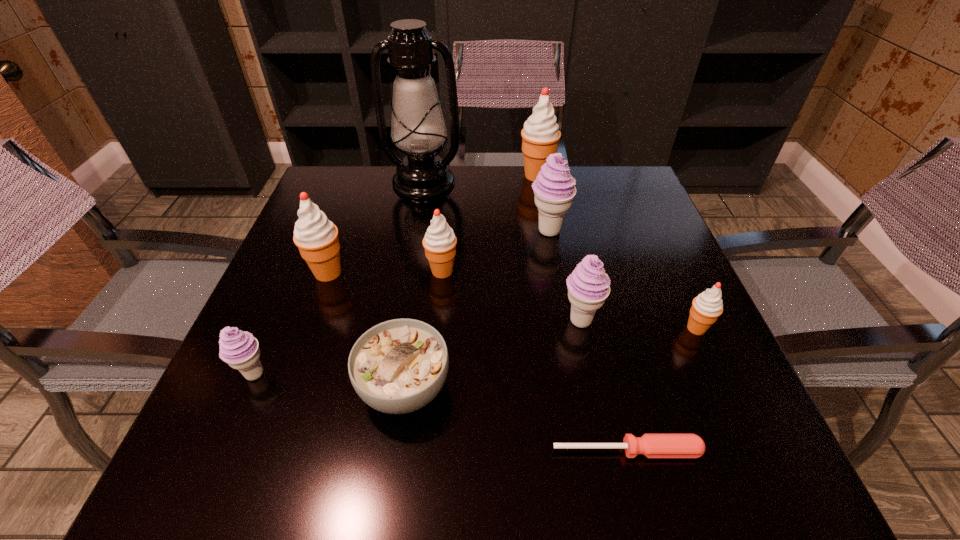
Where is `the rightmost red icecream`? This screenshot has height=540, width=960. the rightmost red icecream is located at coordinates [706, 308].

Where is `the smallest red icecream`? The height and width of the screenshot is (540, 960). the smallest red icecream is located at coordinates (706, 308).

The width and height of the screenshot is (960, 540). I want to click on the smallest purple icecream, so click(240, 350).

This screenshot has width=960, height=540. I want to click on the leftmost purple icecream, so click(240, 350).

The width and height of the screenshot is (960, 540). In order to click on the second shortest object in this screenshot , I will do `click(398, 366)`.

I want to click on soup bowl, so click(x=398, y=366).

Locate an element on the screen. Image resolution: width=960 pixels, height=540 pixels. the nearest object is located at coordinates (650, 445).

This screenshot has height=540, width=960. I want to click on red screwdriver, so click(650, 445).

Image resolution: width=960 pixels, height=540 pixels. Identify the location of vacant position located 0.110m on the right of the black oil lamp. (500, 182).

I want to click on free location located on the left of the second tallest object, so click(x=477, y=176).